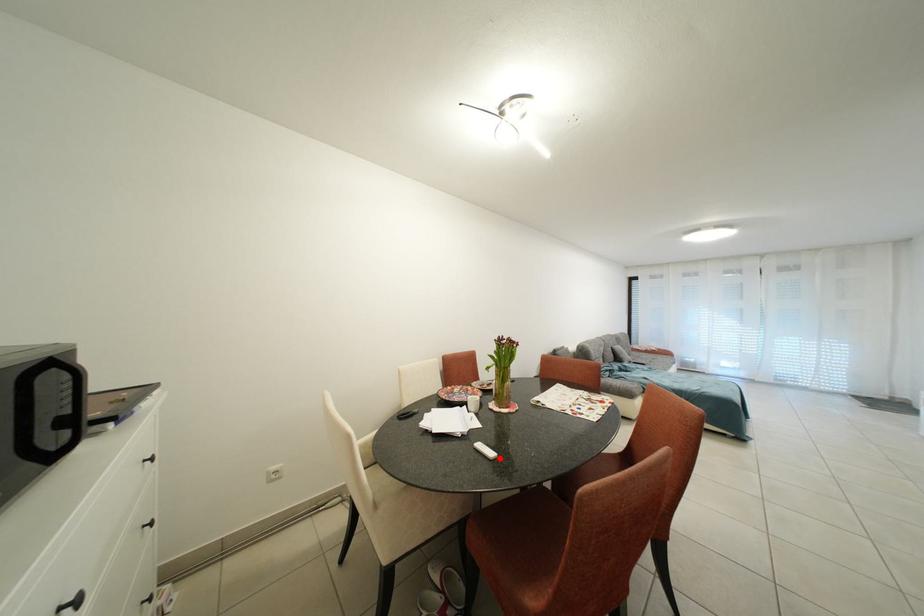
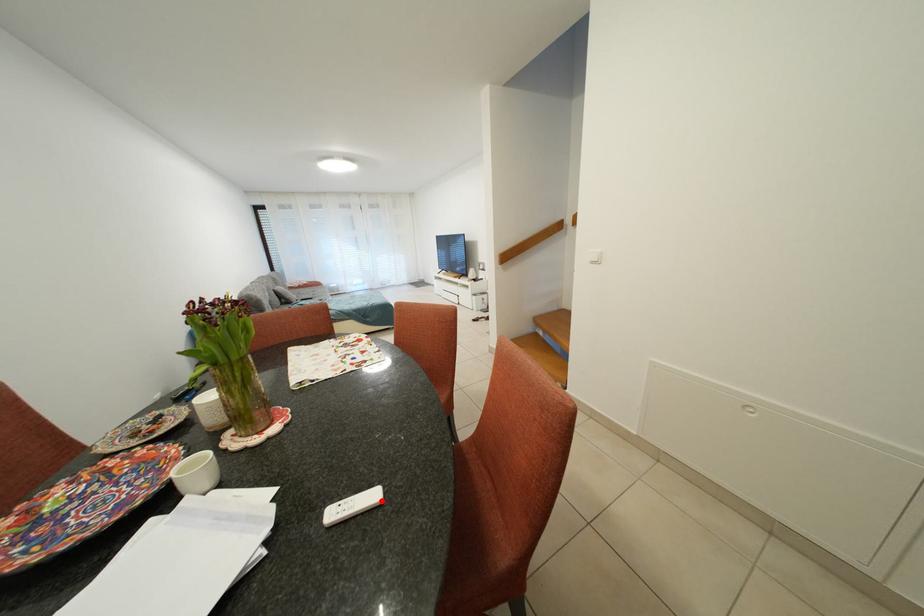
I am providing you with two images of the same scene from different viewpoints. A red point is marked on the first image and another point is marked on the second image. Do the highlighted points in image1 and image2 indicate the same real-world spot?

Yes